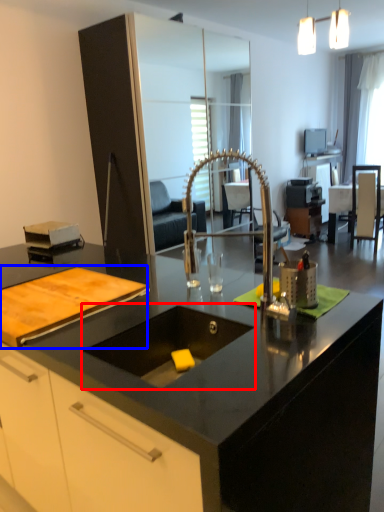
Question: Among these objects, which one is nearest to the camera, sink (highlighted by a red box) or cutting board (highlighted by a blue box)?

Choices:
 (A) sink
 (B) cutting board

Answer: (A)